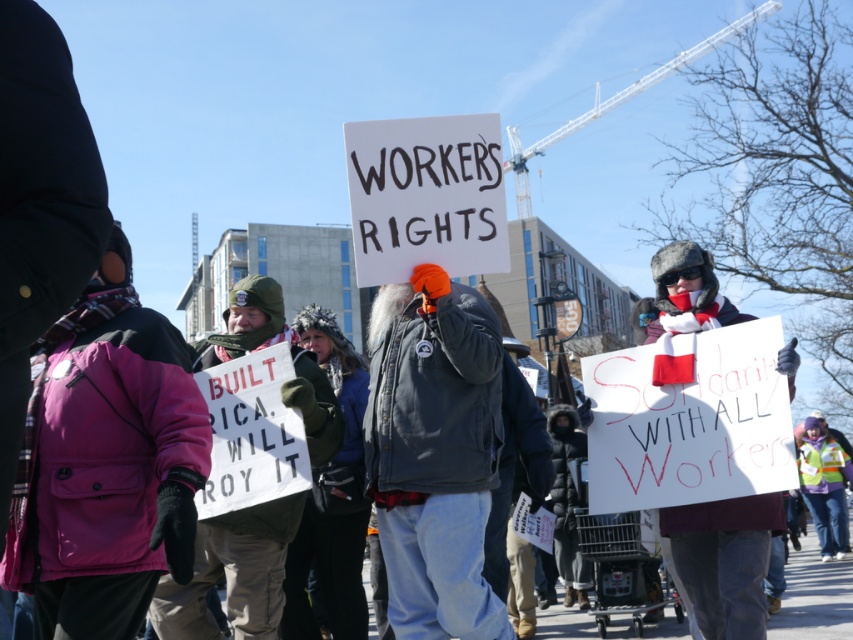
Question: Does denim jacket at center appear on the right side of white paper sign at center?

Choices:
 (A) no
 (B) yes

Answer: (A)

Question: Is camouflage jacket at center above reflective safety vest at center?

Choices:
 (A) yes
 (B) no

Answer: (A)

Question: Is camouflage jacket at center closer to the viewer compared to white paper sign at center?

Choices:
 (A) no
 (B) yes

Answer: (A)

Question: Which point is closer to the camera?

Choices:
 (A) denim jacket at center
 (B) pink fleece jacket at upper left

Answer: (B)

Question: Considering the real-world distances, which object is closest to the reflective safety vest at center?

Choices:
 (A) white paper sign at center
 (B) camouflage jacket at center

Answer: (A)

Question: Which of these objects is positioned farthest from the pink fleece jacket at upper left?

Choices:
 (A) camouflage jacket at center
 (B) white paper sign at center

Answer: (B)